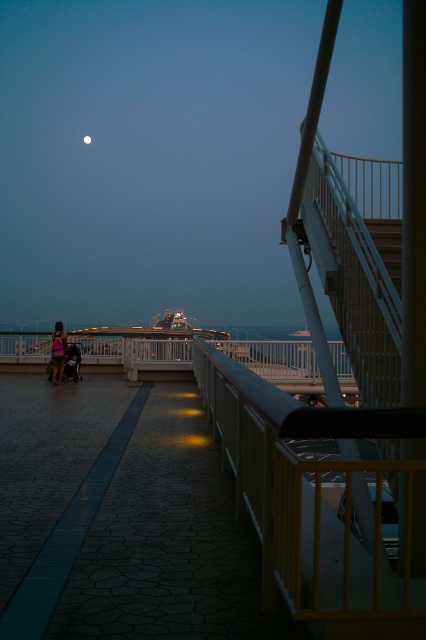
You are a photographer setting up a shot of the bright silver moon at upper center and the matte black jacket at left. You want to ensure both subjects are in focus. Which subject should you prioritize focusing on first to account for their relative sizes?

The matte black jacket at left might be wider than bright silver moon at upper center, so you should prioritize focusing on the matte black jacket at left first since it is larger and requires more precise focus to capture details.

You are an astronomer observing the evening sky from the walkway. You notice the yellow matte balustrade at center and the bright silver moon at upper center. Which object is positioned higher in the scene?

The bright silver moon at upper center is positioned higher than the yellow matte balustrade at center.

You are standing on the walkway and want to pick up the matte black jacket at left. Is the yellow matte balustrade at center in your way?

The yellow matte balustrade at center is closer to the viewer than the matte black jacket at left, so yes, the balustrade is blocking your path to the jacket.